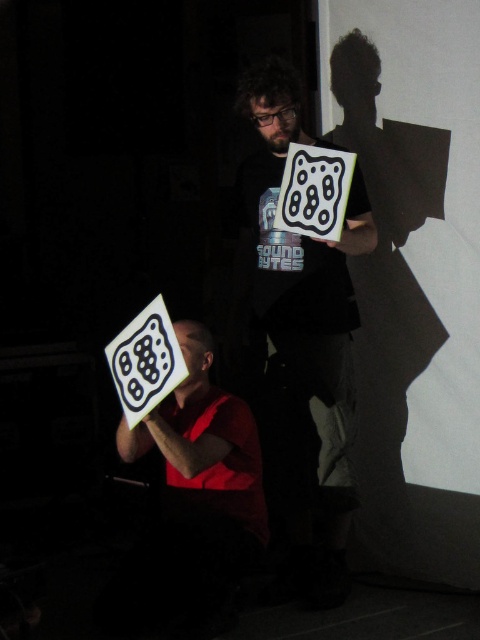
Question: Can you confirm if matte black face at upper center is smaller than matte black face at center?

Choices:
 (A) no
 (B) yes

Answer: (A)

Question: Is white matte sign at center closer to camera compared to white glossy square at lower left?

Choices:
 (A) no
 (B) yes

Answer: (A)

Question: Which point is farther to the camera?

Choices:
 (A) white matte sign at center
 (B) matte black face at center

Answer: (B)

Question: Which of the following is the closest to the observer?

Choices:
 (A) matte black face at center
 (B) white matte square at upper center
 (C) matte black face at upper center
 (D) white matte sign at center

Answer: (B)

Question: Estimate the real-world distances between objects in this image. Which object is closer to the matte black face at center?

Choices:
 (A) white matte square at upper center
 (B) white glossy square at lower left
 (C) white matte sign at center
 (D) matte black face at upper center

Answer: (B)

Question: Is white matte square at upper center below matte black face at center?

Choices:
 (A) yes
 (B) no

Answer: (B)